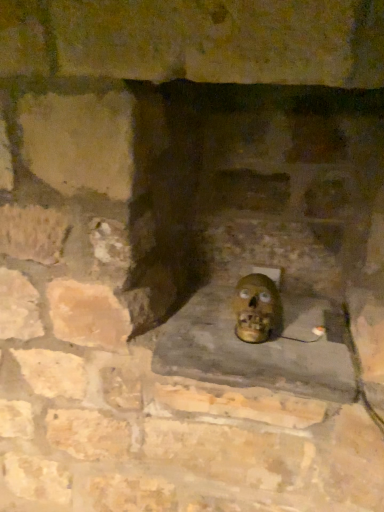
Identify the location of vacant region to the left of gold metallic skull at center. The image size is (384, 512). (196, 332).